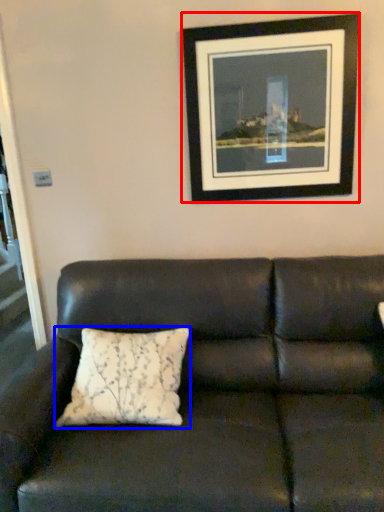
Question: Which object is further to the camera taking this photo, picture frame (highlighted by a red box) or pillow (highlighted by a blue box)?

Choices:
 (A) picture frame
 (B) pillow

Answer: (A)